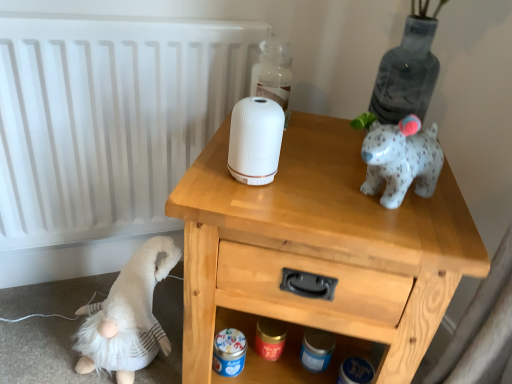
Where is `unoccupied space behind white matte speaker at center`? The width and height of the screenshot is (512, 384). unoccupied space behind white matte speaker at center is located at coordinates (282, 142).